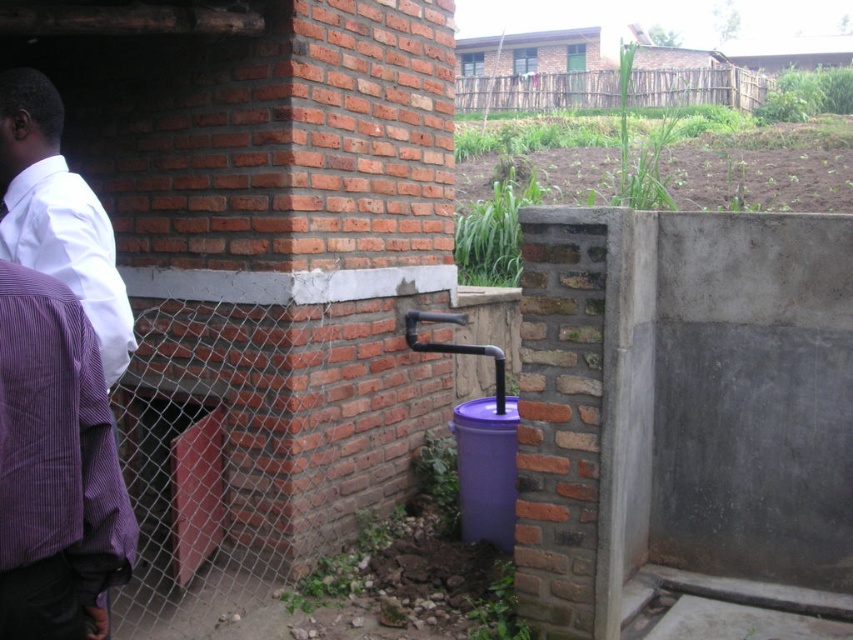
You are standing in front of the brick wall with the water collection system. There are two points marked on the wall at coordinates point (57, 138) and point (605, 92). If you were to draw a straight line between these two points, would the line pass in front of or behind the purple plastic bucket?

The line between point (57, 138) and point (605, 92) would pass in front of the purple plastic bucket because point (57, 138) is in front of point (605, 92).

You are standing in front of the brick structure and notice two items near the wall. You see the purple striped robe at left and the wooden fence at upper center. Which object is taller?

The purple striped robe at left is much taller than the wooden fence at upper center.